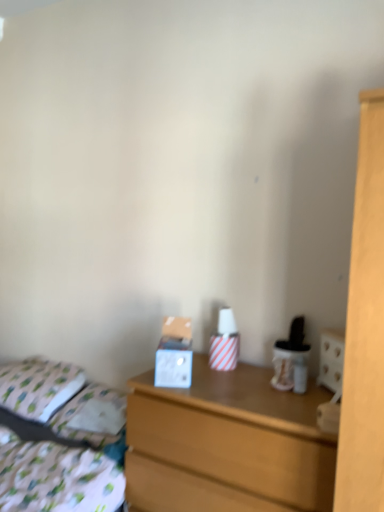
Question: Does patterned fabric bed at lower left have a smaller size compared to white fabric pillow at left?

Choices:
 (A) yes
 (B) no

Answer: (B)

Question: From the image's perspective, is patterned fabric bed at lower left beneath white fabric pillow at left?

Choices:
 (A) yes
 (B) no

Answer: (A)

Question: Is patterned fabric bed at lower left further to camera compared to white fabric pillow at left?

Choices:
 (A) yes
 (B) no

Answer: (B)

Question: Is patterned fabric bed at lower left thinner than white fabric pillow at left?

Choices:
 (A) yes
 (B) no

Answer: (B)

Question: Does patterned fabric bed at lower left appear on the left side of white fabric pillow at left?

Choices:
 (A) yes
 (B) no

Answer: (B)

Question: Considering the positions of wooden chest of drawers at center and white fabric pillow at left in the image, is wooden chest of drawers at center taller or shorter than white fabric pillow at left?

Choices:
 (A) tall
 (B) short

Answer: (A)

Question: In the image, is wooden chest of drawers at center on the left side or the right side of white fabric pillow at left?

Choices:
 (A) right
 (B) left

Answer: (A)

Question: From the image's perspective, is wooden chest of drawers at center above or below white fabric pillow at left?

Choices:
 (A) above
 (B) below

Answer: (B)

Question: Relative to white fabric pillow at left, is wooden chest of drawers at center in front or behind?

Choices:
 (A) front
 (B) behind

Answer: (A)

Question: In terms of width, does white fabric pillow at left look wider or thinner when compared to wooden chest of drawers at center?

Choices:
 (A) wide
 (B) thin

Answer: (B)

Question: Choose the correct answer: Is white fabric pillow at left inside wooden chest of drawers at center or outside it?

Choices:
 (A) inside
 (B) outside

Answer: (B)

Question: Is point (66, 388) closer or farther from the camera than point (210, 437)?

Choices:
 (A) closer
 (B) farther

Answer: (B)

Question: From their relative heights in the image, would you say white fabric pillow at left is taller or shorter than wooden chest of drawers at center?

Choices:
 (A) tall
 (B) short

Answer: (B)

Question: Is patterned fabric bed at lower left spatially inside white fabric pillow at left, or outside of it?

Choices:
 (A) inside
 (B) outside

Answer: (B)

Question: From a real-world perspective, relative to white fabric pillow at left, is patterned fabric bed at lower left vertically above or below?

Choices:
 (A) below
 (B) above

Answer: (A)